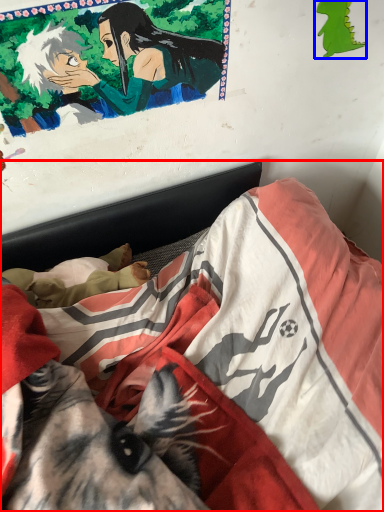
Question: Which object appears closest to the camera in this image, bed (highlighted by a red box) or art (highlighted by a blue box)?

Choices:
 (A) bed
 (B) art

Answer: (A)